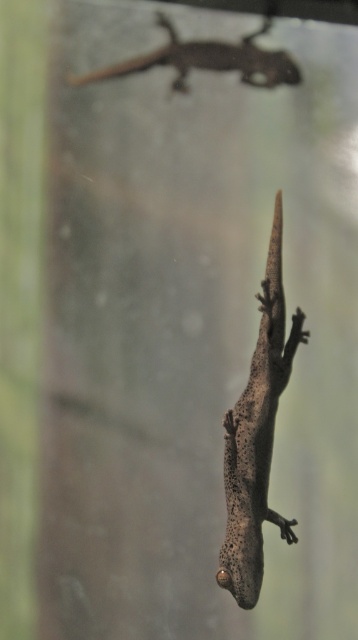
Between point (250, 596) and point (236, 51), which one is positioned behind?

The point (236, 51) is behind.

Between speckled gray lizard at center and smooth brown lizard at upper center, which one has more height?

Standing taller between the two is speckled gray lizard at center.

The width and height of the screenshot is (358, 640). In order to click on speckled gray lizard at center in this screenshot , I will do `click(257, 435)`.